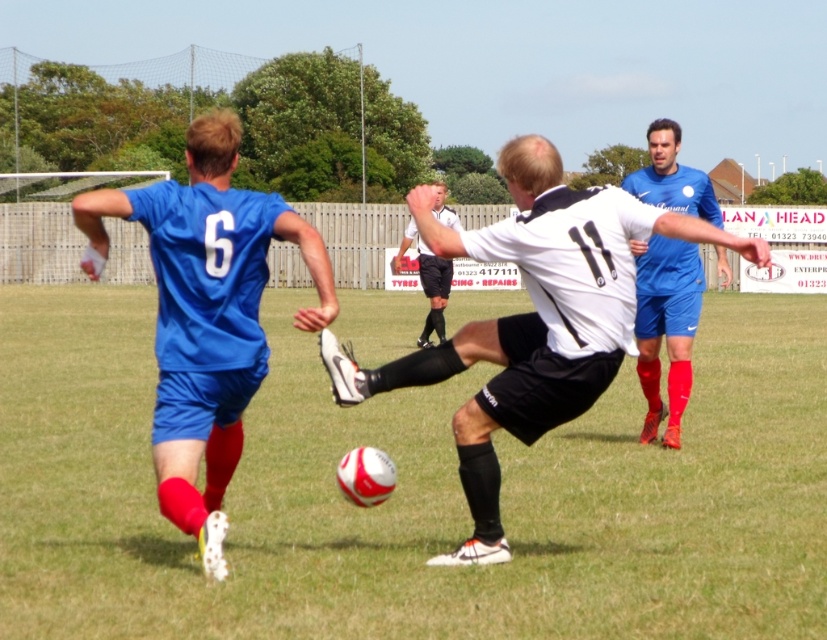
You are a soccer player positioned at the edge of the field and want to pass the ball to your teammate. You see the matte blue jersey at left and the white smooth referee at center. Which player is higher up in the image?

The matte blue jersey at left is above the white smooth referee at center in the image.

You are a soccer coach analyzing this image. You notice the blue matte soccer player at center. Where exactly is this player positioned in the image?

The blue matte soccer player at center is positioned at point (667, 326).